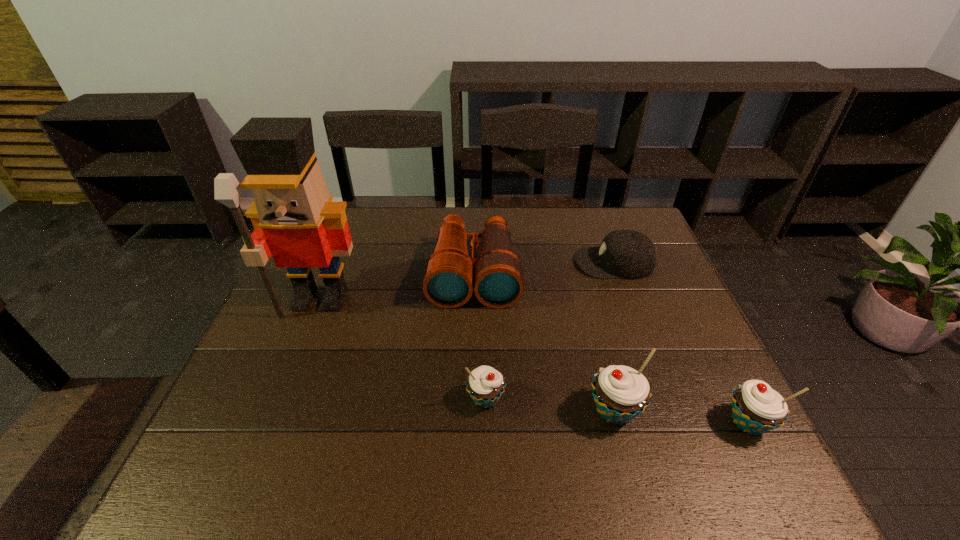
This screenshot has width=960, height=540. I want to click on object that is positioned at the far right corner, so click(630, 254).

Find the location of a particular element. The height and width of the screenshot is (540, 960). object located in the near right corner section of the desktop is located at coordinates (756, 408).

Where is `vacant space at the far edge`? The width and height of the screenshot is (960, 540). vacant space at the far edge is located at coordinates (497, 207).

At what (x,y) coordinates should I click in order to perform the action: click on blank area at the near edge. Please return your answer as a coordinate pair (x, y). Image resolution: width=960 pixels, height=540 pixels. Looking at the image, I should click on (534, 435).

In the image, there is a desktop. What are the coordinates of `vacant space at the left edge` in the screenshot? It's located at (313, 323).

Find the location of `vacant space at the right edge of the desktop`. vacant space at the right edge of the desktop is located at coordinates (673, 279).

This screenshot has width=960, height=540. Identify the location of vacant area at the near left corner. (214, 424).

I want to click on free spot between the binoculars and the second tallest cupcake, so click(611, 348).

Locate an element on the screen. This screenshot has height=540, width=960. vacant space in between the cap and the binoculars is located at coordinates (544, 268).

Locate an element on the screen. This screenshot has width=960, height=540. free space between the leftmost cupcake and the second cupcake from right to left is located at coordinates (550, 405).